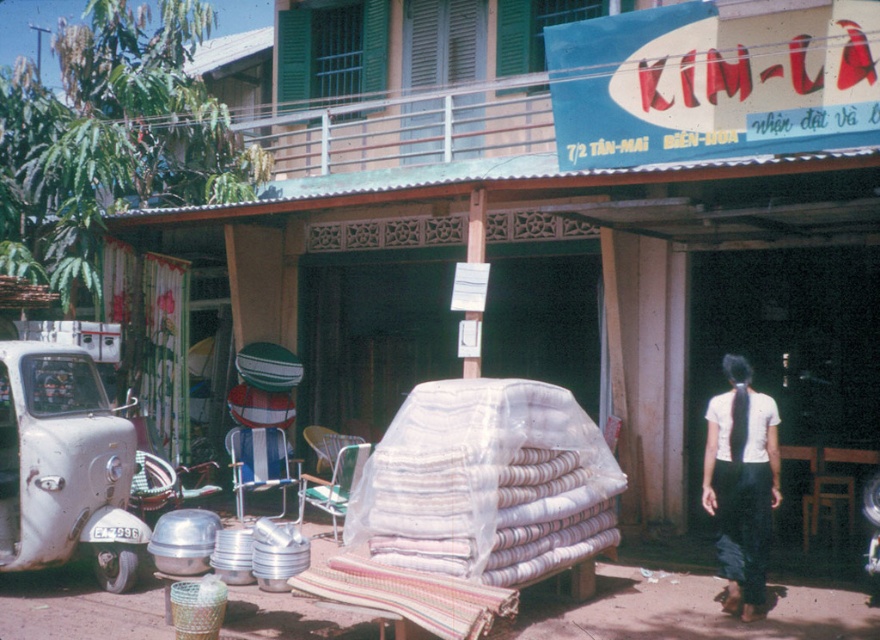
Can you confirm if white matte car at left is taller than white cotton shirt at center?

Indeed, white matte car at left has a greater height compared to white cotton shirt at center.

Is white matte car at left further to camera compared to white cotton shirt at center?

Yes, white matte car at left is further from the viewer.

Is point (16, 422) farther from camera compared to point (730, 429)?

That is True.

Locate an element on the screen. This screenshot has width=880, height=640. white matte car at left is located at coordinates (63, 465).

Is point (488, 573) more distant than point (704, 508)?

No, (488, 573) is closer to viewer.

Which of these two, white woven blanket at center or white cotton shirt at center, stands taller?

With more height is white cotton shirt at center.

Find the location of a particular element. The image size is (880, 640). white woven blanket at center is located at coordinates click(x=486, y=483).

Between point (459, 534) and point (77, 349), which one is positioned behind?

Positioned behind is point (77, 349).

Does point (426, 408) come closer to viewer compared to point (71, 397)?

Yes, it is.

At what (x,y) coordinates should I click in order to perform the action: click on white woven blanket at center. Please return your answer as a coordinate pair (x, y). Looking at the image, I should click on (486, 483).